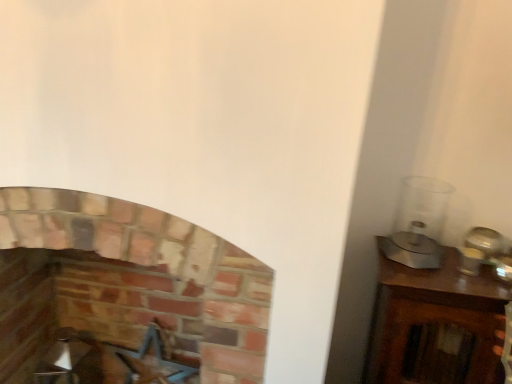
What is the approximate height of metallic blue swivel chair at lower left?

metallic blue swivel chair at lower left is 40.91 centimeters tall.

Find the location of a particular element. This screenshot has width=512, height=384. metallic blue swivel chair at lower left is located at coordinates (110, 362).

The image size is (512, 384). What do you see at coordinates (110, 362) in the screenshot?
I see `metallic blue swivel chair at lower left` at bounding box center [110, 362].

In order to click on brick fireplace at center in this screenshot , I will do (154, 276).

What is the approximate height of brick fireplace at center?

The height of brick fireplace at center is 1.13 meters.

What do you see at coordinates (154, 276) in the screenshot? I see `brick fireplace at center` at bounding box center [154, 276].

Where is `metallic blue swivel chair at lower left`? The width and height of the screenshot is (512, 384). metallic blue swivel chair at lower left is located at coordinates (110, 362).

Between metallic blue swivel chair at lower left and brick fireplace at center, which one appears on the left side from the viewer's perspective?

brick fireplace at center is more to the left.

Is metallic blue swivel chair at lower left in front of brick fireplace at center?

No, it is behind brick fireplace at center.

Is point (90, 363) closer or farther from the camera than point (101, 305)?

Point (90, 363).

From the image's perspective, does metallic blue swivel chair at lower left appear higher than brick fireplace at center?

No, from the image's perspective, metallic blue swivel chair at lower left is not above brick fireplace at center.

From a real-world perspective, relative to brick fireplace at center, is metallic blue swivel chair at lower left vertically above or below?

metallic blue swivel chair at lower left is situated lower than brick fireplace at center in the real world.

Is metallic blue swivel chair at lower left wider than brick fireplace at center?

No.

Which of these two, metallic blue swivel chair at lower left or brick fireplace at center, stands taller?

Standing taller between the two is brick fireplace at center.

Between metallic blue swivel chair at lower left and brick fireplace at center, which one has larger size?

brick fireplace at center.

Does metallic blue swivel chair at lower left contain brick fireplace at center?

No, brick fireplace at center is not a part of metallic blue swivel chair at lower left.

Is metallic blue swivel chair at lower left far from brick fireplace at center?

They are positioned close to each other.

Is metallic blue swivel chair at lower left turned away from brick fireplace at center?

Yes, metallic blue swivel chair at lower left is positioned with its back facing brick fireplace at center.

What are the coordinates of `swivel chair that appears below the brick fireplace at center (from a real-world perspective)` in the screenshot? It's located at (110, 362).

In the image, is brick fireplace at center on the left side or the right side of metallic blue swivel chair at lower left?

Based on their positions, brick fireplace at center is located to the left of metallic blue swivel chair at lower left.

Does brick fireplace at center come in front of metallic blue swivel chair at lower left?

Yes, the depth of brick fireplace at center is less than that of metallic blue swivel chair at lower left.

Is point (101, 317) less distant than point (120, 352)?

Yes, point (101, 317) is closer to viewer.

From the image's perspective, is brick fireplace at center over metallic blue swivel chair at lower left?

Yes, from the image's perspective, brick fireplace at center is on top of metallic blue swivel chair at lower left.

From a real-world perspective, is brick fireplace at center on metallic blue swivel chair at lower left?

→ Indeed, from a real-world perspective, brick fireplace at center stands above metallic blue swivel chair at lower left.

Between brick fireplace at center and metallic blue swivel chair at lower left, which one has larger width?

brick fireplace at center.

Considering the relative sizes of brick fireplace at center and metallic blue swivel chair at lower left in the image provided, is brick fireplace at center shorter than metallic blue swivel chair at lower left?

No.

Considering the relative sizes of brick fireplace at center and metallic blue swivel chair at lower left in the image provided, is brick fireplace at center smaller than metallic blue swivel chair at lower left?

Actually, brick fireplace at center might be larger than metallic blue swivel chair at lower left.

Is brick fireplace at center inside the boundaries of metallic blue swivel chair at lower left, or outside?

brick fireplace at center is outside metallic blue swivel chair at lower left.

Would you say brick fireplace at center is a long distance from metallic blue swivel chair at lower left?

No, brick fireplace at center is in close proximity to metallic blue swivel chair at lower left.

Is brick fireplace at center looking in the opposite direction of metallic blue swivel chair at lower left?

Yes.

How many degrees apart are the facing directions of brick fireplace at center and metallic blue swivel chair at lower left?

brick fireplace at center and metallic blue swivel chair at lower left are facing 0.995 degrees away from each other.

Measure the distance from brick fireplace at center to metallic blue swivel chair at lower left.

A distance of 26.54 inches exists between brick fireplace at center and metallic blue swivel chair at lower left.

At what (x,y) coordinates should I click in order to perform the action: click on fireplace on the left of metallic blue swivel chair at lower left. Please return your answer as a coordinate pair (x, y). The width and height of the screenshot is (512, 384). Looking at the image, I should click on (154, 276).

Image resolution: width=512 pixels, height=384 pixels. In order to click on fireplace located above the metallic blue swivel chair at lower left (from a real-world perspective) in this screenshot , I will do `click(154, 276)`.

Image resolution: width=512 pixels, height=384 pixels. I want to click on swivel chair that appears below the brick fireplace at center (from the image's perspective), so click(110, 362).